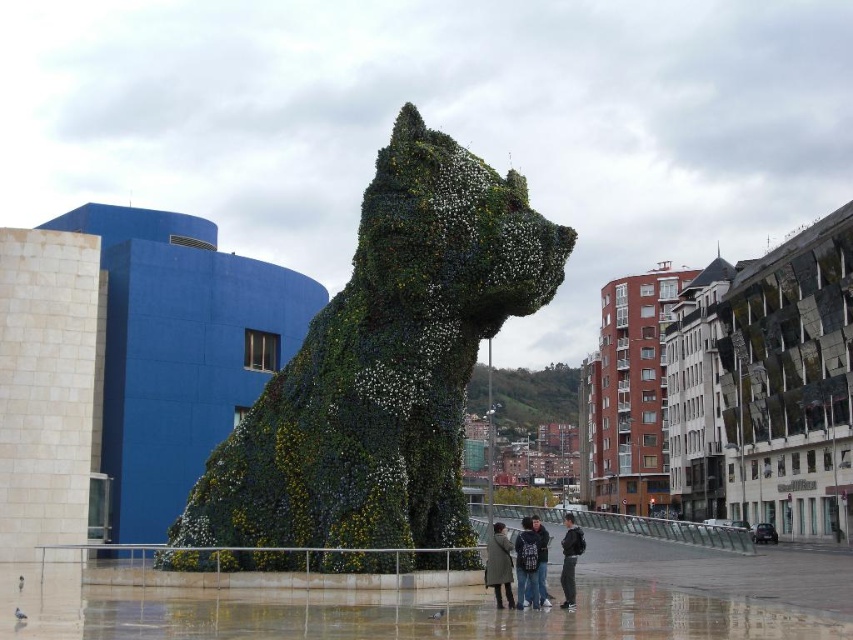
Question: Does dark blue jacket at center appear on the right side of green wool coat at center?

Choices:
 (A) no
 (B) yes

Answer: (B)

Question: Observing the image, what is the correct spatial positioning of green leafy sculpture at center in reference to dark gray jacket at lower center?

Choices:
 (A) below
 (B) above

Answer: (B)

Question: Which of the following is the farthest from the observer?

Choices:
 (A) (537, 604)
 (B) (538, 592)
 (C) (579, 547)

Answer: (C)

Question: Estimate the real-world distances between objects in this image. Which object is farther from the denim jacket at center?

Choices:
 (A) dark blue jacket at center
 (B) green leafy sculpture at center
 (C) green wool coat at center

Answer: (A)

Question: Which of these objects is positioned farthest from the dark blue jacket at center?

Choices:
 (A) dark gray jacket at lower center
 (B) green leafy sculpture at center
 (C) green wool coat at center
 (D) denim jacket at center

Answer: (D)

Question: Can you confirm if green leafy sculpture at center is positioned to the left of dark gray jacket at lower center?

Choices:
 (A) no
 (B) yes

Answer: (B)